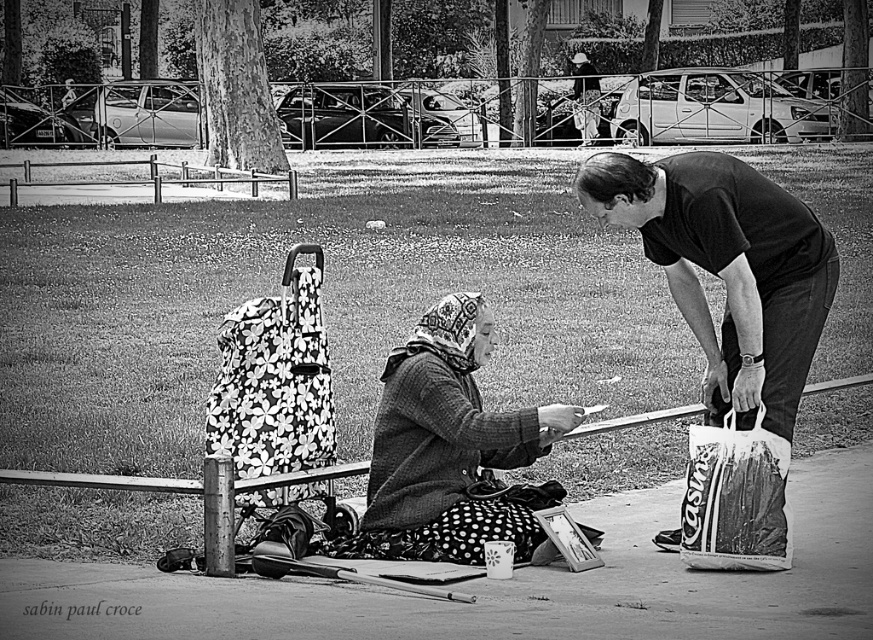
Question: Which object is closer to the camera taking this photo?

Choices:
 (A) white plastic bag at lower right
 (B) dark gray t-shirt at center right
 (C) floral fabric baby carriage at left

Answer: (B)

Question: Which object is farther from the camera taking this photo?

Choices:
 (A) white plastic bag at lower right
 (B) floral fabric baby carriage at left
 (C) dark gray t-shirt at center right

Answer: (B)

Question: Which is farther from the dark gray t-shirt at center right?

Choices:
 (A) knitted woolen scarf at center
 (B) floral fabric baby carriage at left

Answer: (B)

Question: Does floral fabric baby carriage at left lie behind white plastic bag at lower right?

Choices:
 (A) yes
 (B) no

Answer: (A)

Question: Is dark gray t-shirt at center right thinner than knitted woolen scarf at center?

Choices:
 (A) no
 (B) yes

Answer: (A)

Question: Is floral fabric baby carriage at left positioned in front of white plastic bag at lower right?

Choices:
 (A) no
 (B) yes

Answer: (A)